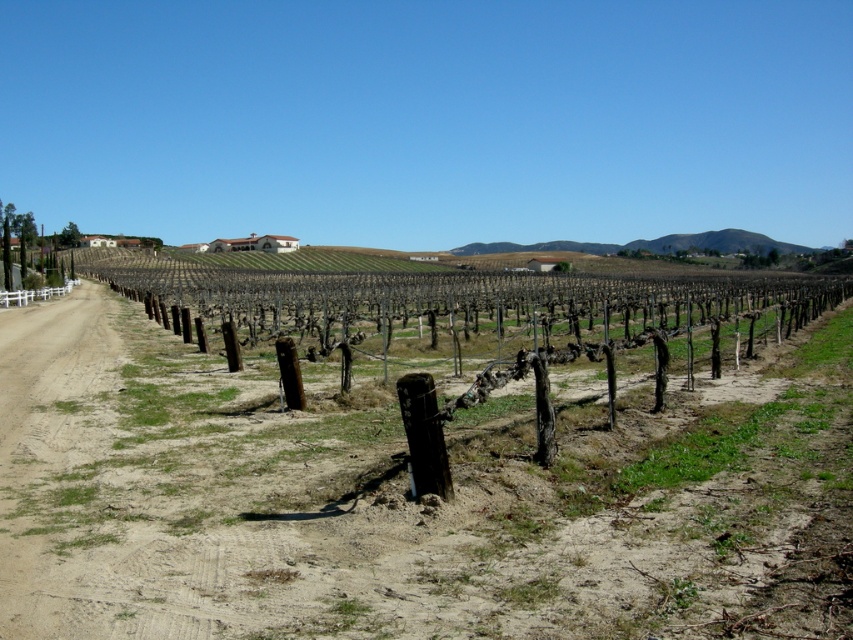
Who is positioned more to the right, brown dirt field at center or white plastic fence at left?

From the viewer's perspective, brown dirt field at center appears more on the right side.

This screenshot has height=640, width=853. Find the location of `brown dirt field at center`. brown dirt field at center is located at coordinates (408, 493).

Locate an element on the screen. brown dirt field at center is located at coordinates (408, 493).

Who is lower down, brown dirt field at center or brown wooden fence at center?

brown dirt field at center is lower down.

Which is more to the right, brown dirt field at center or brown wooden fence at center?

brown wooden fence at center is more to the right.

Who is more distant from viewer, (345, 632) or (416, 296)?

The point (416, 296) is behind.

Identify the location of brown dirt field at center. This screenshot has height=640, width=853. (408, 493).

This screenshot has height=640, width=853. What do you see at coordinates (469, 300) in the screenshot?
I see `brown wooden fence at center` at bounding box center [469, 300].

Is point (231, 316) farther from camera compared to point (65, 282)?

No, (231, 316) is in front of (65, 282).

What are the coordinates of `brown wooden fence at center` in the screenshot? It's located at (469, 300).